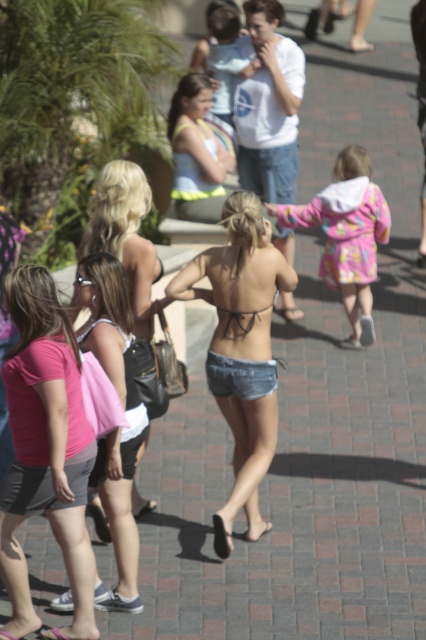
Image resolution: width=426 pixels, height=640 pixels. What do you see at coordinates (241, 349) in the screenshot?
I see `denim shorts at center` at bounding box center [241, 349].

Does denim shorts at center appear under pink fabric dress at lower left?

Actually, denim shorts at center is above pink fabric dress at lower left.

Describe the element at coordinates (241, 349) in the screenshot. I see `denim shorts at center` at that location.

I want to click on denim shorts at center, so click(x=241, y=349).

The image size is (426, 640). Describe the element at coordinates (118, 428) in the screenshot. I see `pink fabric dress at lower left` at that location.

Is pink fabric dress at lower left below matte yellow bikini top at center?

Yes, pink fabric dress at lower left is below matte yellow bikini top at center.

Where is `pink fabric dress at lower left`? Image resolution: width=426 pixels, height=640 pixels. pink fabric dress at lower left is located at coordinates (118, 428).

Is pink fabric dress at lower left positioned before fluffy pink coat at center?

Yes, it is in front of fluffy pink coat at center.

Who is positioned more to the left, pink fabric dress at lower left or fluffy pink coat at center?

From the viewer's perspective, pink fabric dress at lower left appears more on the left side.

Is point (106, 333) less distant than point (368, 257)?

Yes, it is in front of point (368, 257).

You are a GUI agent. You are given a task and a screenshot of the screen. Output one action in this format:
    pyautogui.click(x=<x>, y=<y>)
    Task: Click on the pink fabric dress at lower left
    
    Given the screenshot: What is the action you would take?
    pyautogui.click(x=118, y=428)